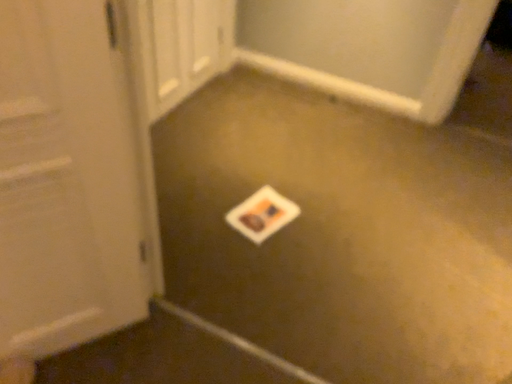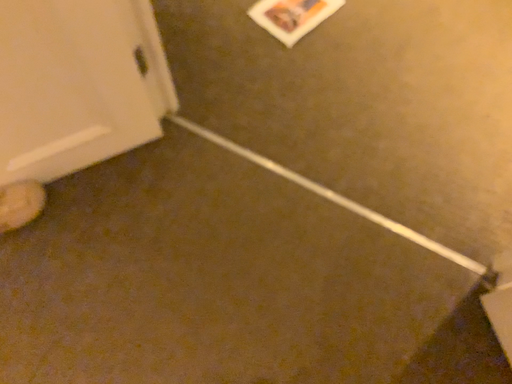
Question: How did the camera likely rotate when shooting the video?

Choices:
 (A) rotated downward
 (B) rotated upward

Answer: (A)